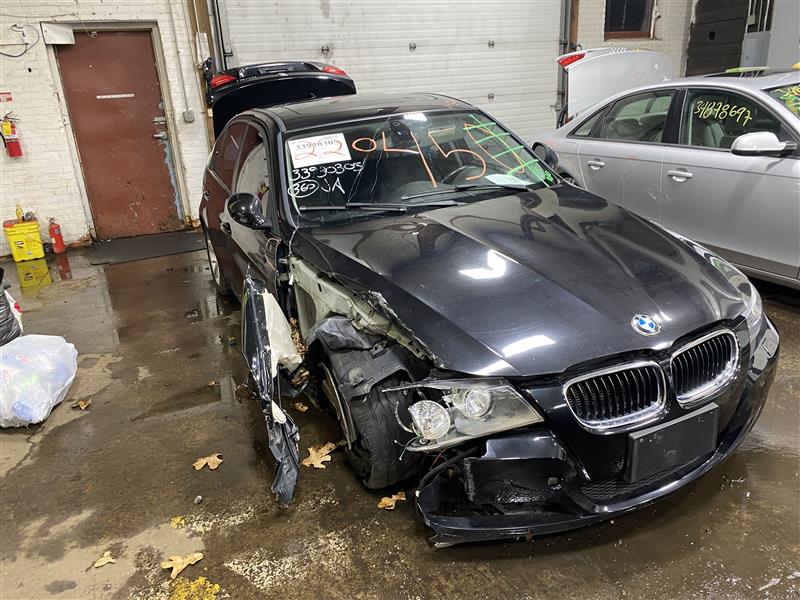
This screenshot has height=600, width=800. I want to click on fire extinguisher, so click(x=53, y=241).